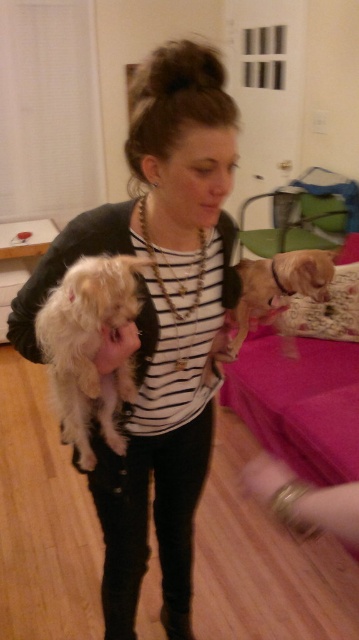
You are a photographer standing 1.38 meters away from the point at coordinates (x=166, y=486). You want to take a photo of the woman holding the two dogs. Will you be able to capture the entire scene in your shot if your camera has a 50mm lens?

The distance between you and the point at coordinates (x=166, y=486) is 1.38 meters. A 50mm lens typically has a field of view that can capture a subject at this distance, so yes, you should be able to include the entire scene in your photo.

You are a photographer trying to capture the woman in the scene. According to the coordinates provided, where should you focus your camera to ensure the white striped shirt at center is in the frame?

The white striped shirt at center is located at coordinates point [157,323], so you should focus your camera there to ensure it is in the frame.